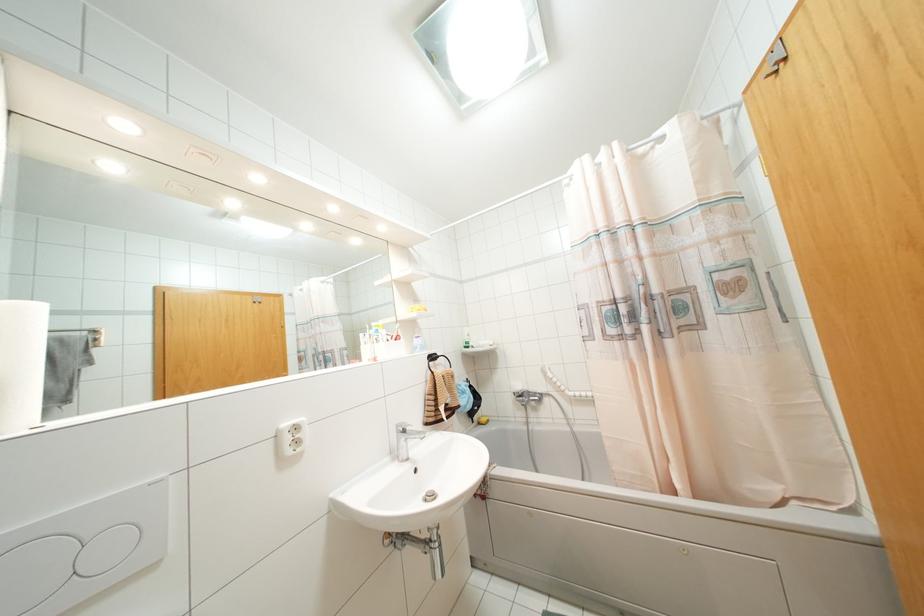
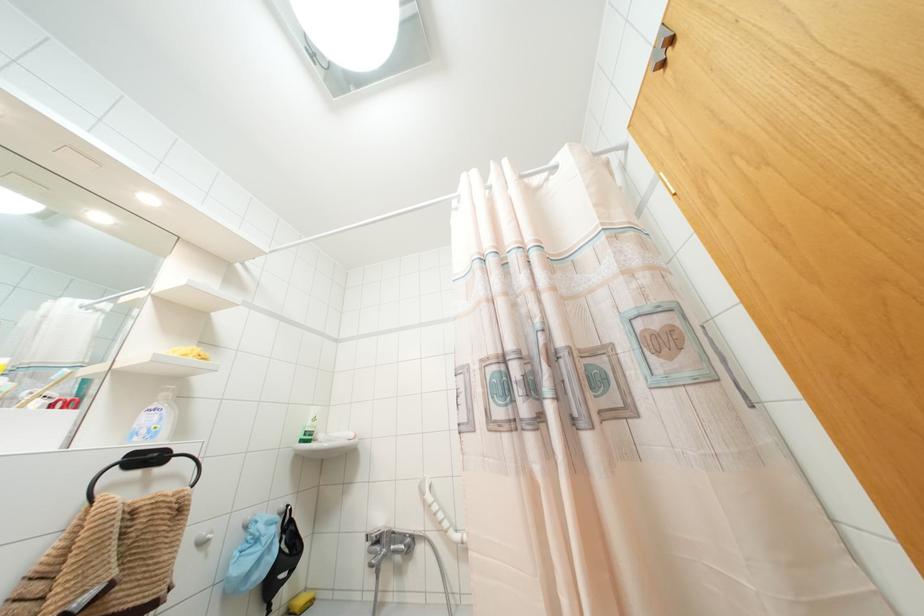
Find the pixel in the second image that matches point 529,395 in the first image.

(390, 541)